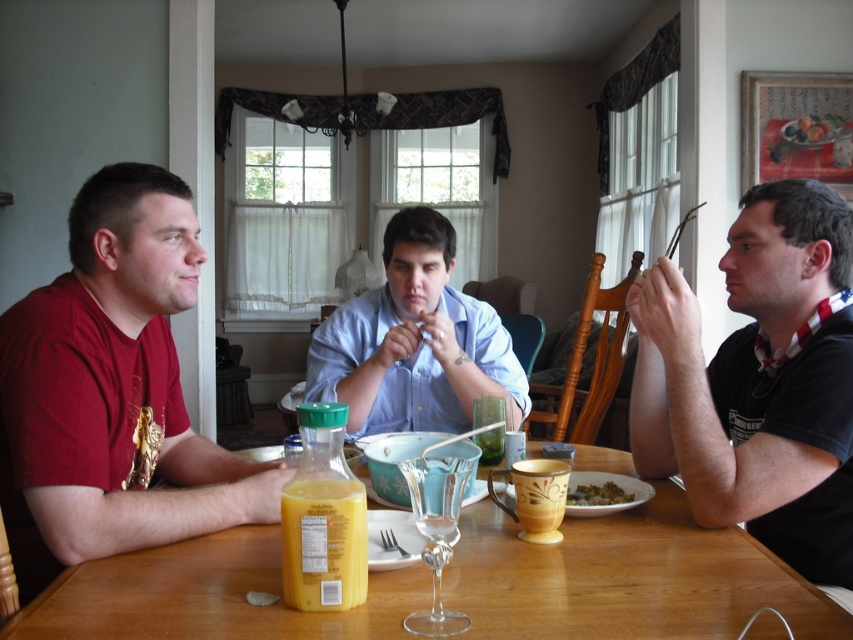
Question: Estimate the real-world distances between objects in this image. Which object is farther from the black matte shirt at right?

Choices:
 (A) translucent glass at table center
 (B) yellow translucent plastic bottle at lower center

Answer: (B)

Question: Does light blue shirt at center have a smaller size compared to transparent glass wine glass at center?

Choices:
 (A) no
 (B) yes

Answer: (A)

Question: Can you confirm if yellow translucent plastic bottle at lower center is positioned below transparent glass wine glass at center?

Choices:
 (A) yes
 (B) no

Answer: (B)

Question: Estimate the real-world distances between objects in this image. Which object is farther from the black matte shirt at right?

Choices:
 (A) translucent glass at table center
 (B) wooden table at center
 (C) transparent glass wine glass at center
 (D) matte red shirt at left

Answer: (D)

Question: Is transparent glass wine glass at center bigger than translucent glass at table center?

Choices:
 (A) no
 (B) yes

Answer: (B)

Question: Among these objects, which one is nearest to the camera?

Choices:
 (A) translucent glass at table center
 (B) matte red shirt at left
 (C) wooden table at center

Answer: (C)